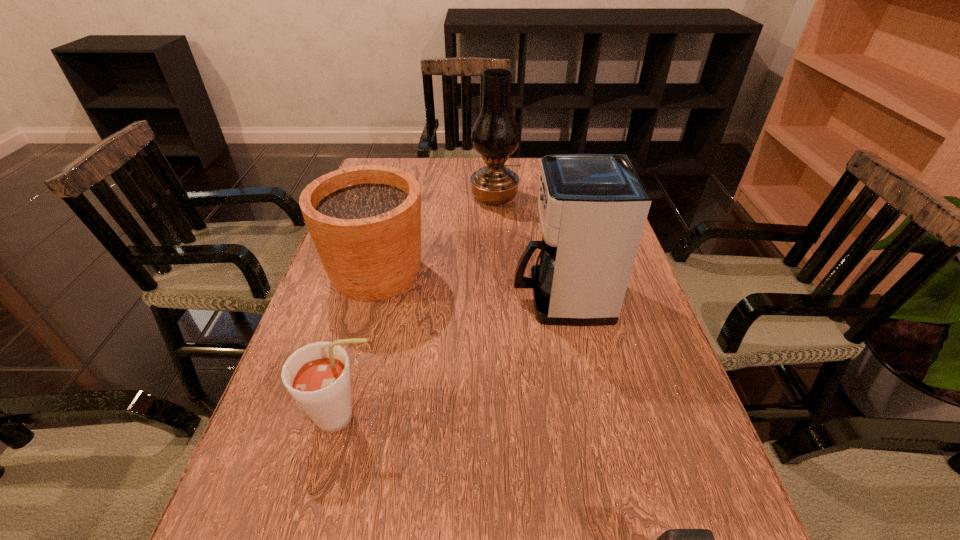
This screenshot has height=540, width=960. In order to click on the farthest object in this screenshot , I will do `click(495, 135)`.

Find the location of a particular element. This screenshot has width=960, height=540. coffee maker is located at coordinates (593, 208).

Where is `flowerpot`? The width and height of the screenshot is (960, 540). flowerpot is located at coordinates pyautogui.click(x=365, y=221).

At what (x,y) coordinates should I click in order to perform the action: click on the second nearest object. Please return your answer as a coordinate pair (x, y). Looking at the image, I should click on (317, 375).

Image resolution: width=960 pixels, height=540 pixels. What are the coordinates of `root beer` in the screenshot? It's located at (317, 375).

The width and height of the screenshot is (960, 540). Find the location of `vacant space located on the front of the farthest object`. vacant space located on the front of the farthest object is located at coordinates (498, 284).

The width and height of the screenshot is (960, 540). Identify the location of vacant space located 0.140m on the front panel of the coffee maker. (451, 298).

Identify the location of free space located 0.120m on the front panel of the coffee maker. This screenshot has height=540, width=960. (460, 298).

The width and height of the screenshot is (960, 540). I want to click on free point located 0.390m on the front panel of the coffee maker, so click(341, 298).

Find the location of a particular element. Image resolution: width=960 pixels, height=540 pixels. vacant point located on the back of the flowerpot is located at coordinates (394, 210).